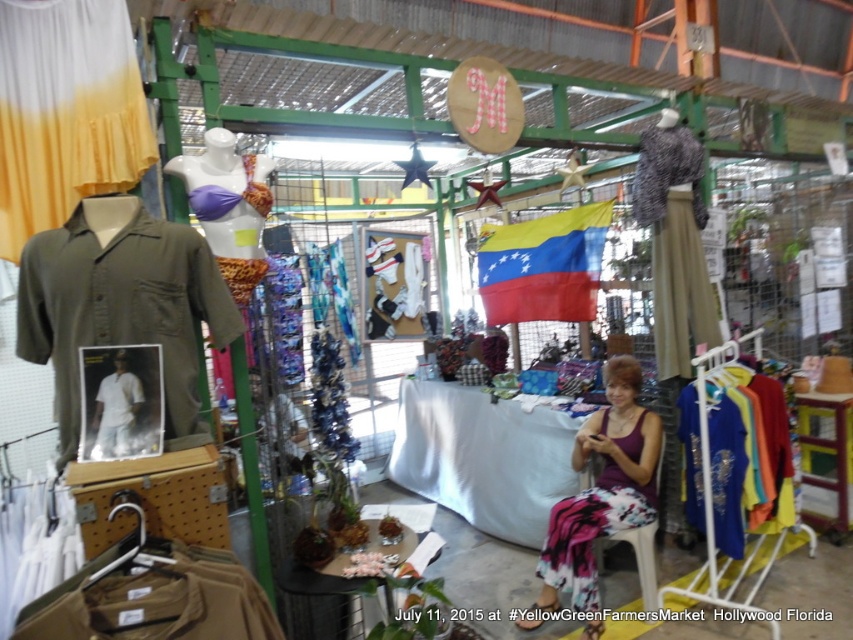
You are a customer at the YellowGreen Farmers Market and you see the tan cotton shirt at lower left and the white cotton shirt at center. Which shirt is closer to you?

The tan cotton shirt at lower left is closer to you because it is in front of the white cotton shirt at center.

You are a customer at the YellowGreen Farmers Market and want to see both the olive green fabric shirt at left and the blue silk blouse at right. Which one do you need to walk around to view the back of?

To view the back of both the olive green fabric shirt at left and the blue silk blouse at right, you need to walk around the olive green fabric shirt at left since it is in front of the blue silk blouse at right.

You are a customer at the YellowGreen Farmers Market in Hollywood, Florida, looking at the olive green fabric shirt at left and the white cotton shirt at center. Which shirt is closer to you?

The olive green fabric shirt at left is closer to you because it is further to the viewer than the white cotton shirt at center.